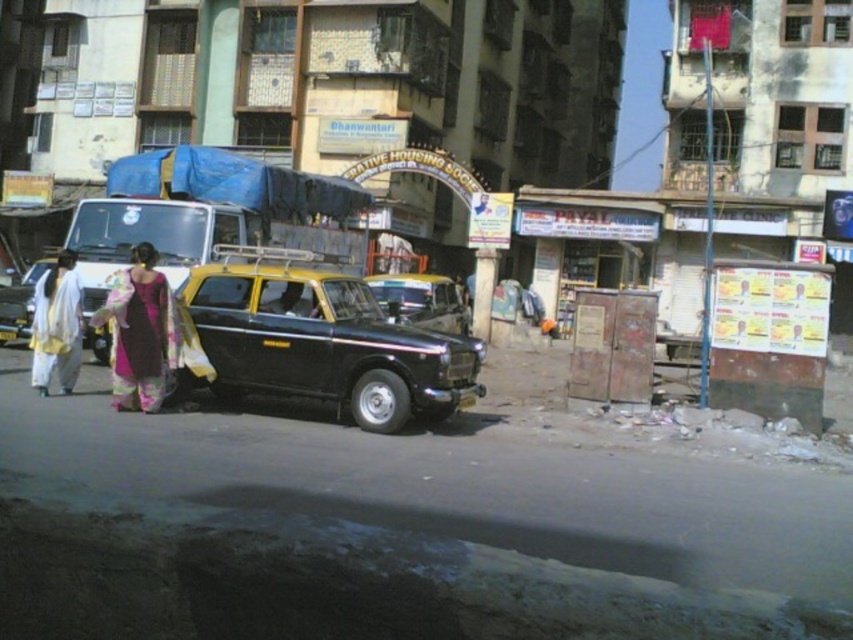
From the picture: How much distance is there between silky purple saree at center and white cotton saree at left?

silky purple saree at center is 1.44 meters away from white cotton saree at left.

Which is in front, point (137, 358) or point (45, 323)?

Point (137, 358) is in front.

Who is more distant from viewer, [131,300] or [50,320]?

Point [50,320]

The image size is (853, 640). I want to click on silky purple saree at center, so click(140, 332).

Is silky purple saree at center bigger than yellow matte taxi at center?

Yes, silky purple saree at center is bigger than yellow matte taxi at center.

Which is above, silky purple saree at center or yellow matte taxi at center?

yellow matte taxi at center is above.

Is point (161, 372) positioned in front of point (403, 291)?

Yes, it is.

Where is `silky purple saree at center`? silky purple saree at center is located at coordinates (140, 332).

Is black matte taxi at center shorter than silky purple saree at center?

No.

Does point (415, 352) lie in front of point (126, 344)?

Yes, it is.

In order to click on black matte taxi at center in this screenshot , I will do `click(322, 340)`.